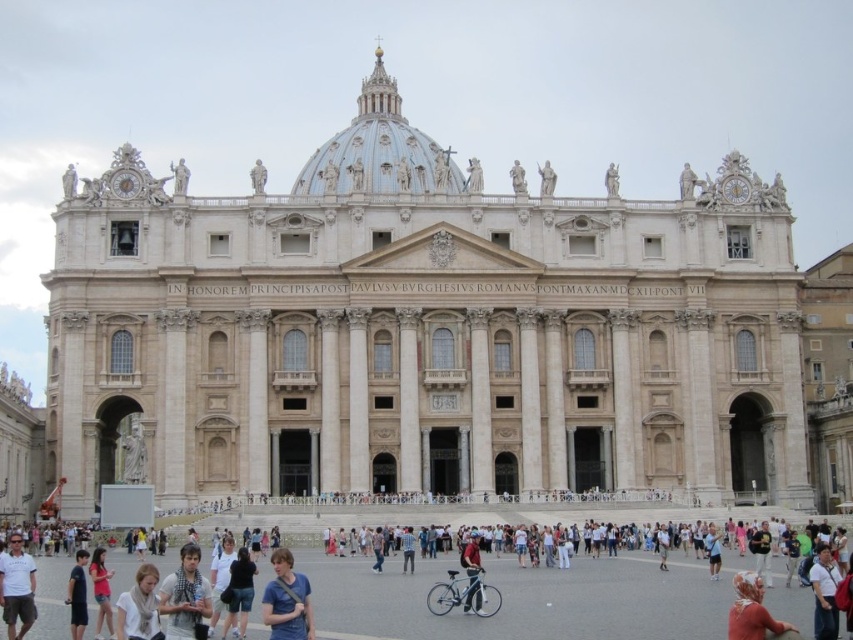
Is white cotton shirt at lower left thinner than white cotton shirt at lower right?

No, white cotton shirt at lower left is not thinner than white cotton shirt at lower right.

How much distance is there between white cotton shirt at lower left and white cotton shirt at lower right?

They are 32.92 meters apart.

Is point (13, 556) closer to camera compared to point (813, 621)?

Yes, it is.

Locate an element on the screen. The image size is (853, 640). white cotton shirt at lower left is located at coordinates (16, 588).

Who is higher up, blue cotton shirt at lower center or dark blue shirt at lower left?

blue cotton shirt at lower center is higher up.

Is point (271, 588) positioned after point (79, 609)?

No, it is not.

Which is behind, point (303, 596) or point (82, 552)?

Positioned behind is point (82, 552).

Locate an element on the screen. Image resolution: width=853 pixels, height=640 pixels. blue cotton shirt at lower center is located at coordinates (287, 600).

Does white fabric headscarf at lower right lie behind matte pink shirt at lower left?

No, white fabric headscarf at lower right is in front of matte pink shirt at lower left.

Which is behind, point (740, 612) or point (100, 566)?

The point (100, 566) is behind.

Who is more distant from viewer, (740, 572) or (93, 557)?

Positioned behind is point (740, 572).

Locate an element on the screen. The height and width of the screenshot is (640, 853). white fabric headscarf at lower right is located at coordinates (751, 611).